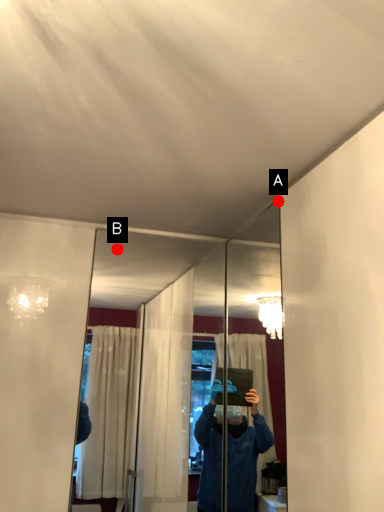
Question: Two points are circled on the image, labeled by A and B beside each circle. Which point appears farthest from the camera in this image?

Choices:
 (A) A is further
 (B) B is further

Answer: (B)